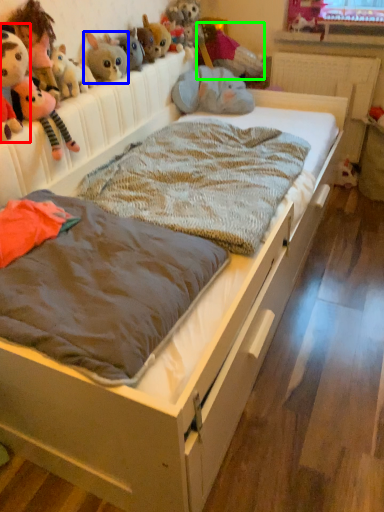
Question: Which object is positioned closest to toy (highlighted by a red box)? Select from toy (highlighted by a blue box) and toy (highlighted by a green box).

Choices:
 (A) toy
 (B) toy

Answer: (A)